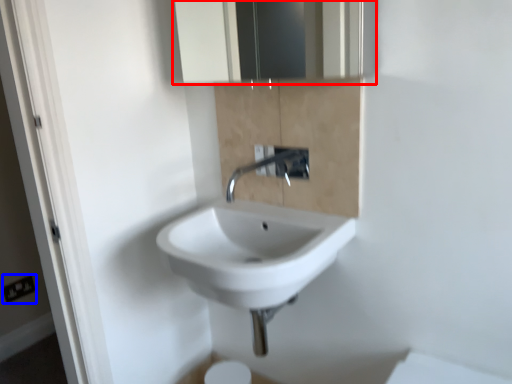
Question: Which object is closer to the camera taking this photo, medicine cabinet (highlighted by a red box) or electric outlet (highlighted by a blue box)?

Choices:
 (A) medicine cabinet
 (B) electric outlet

Answer: (A)